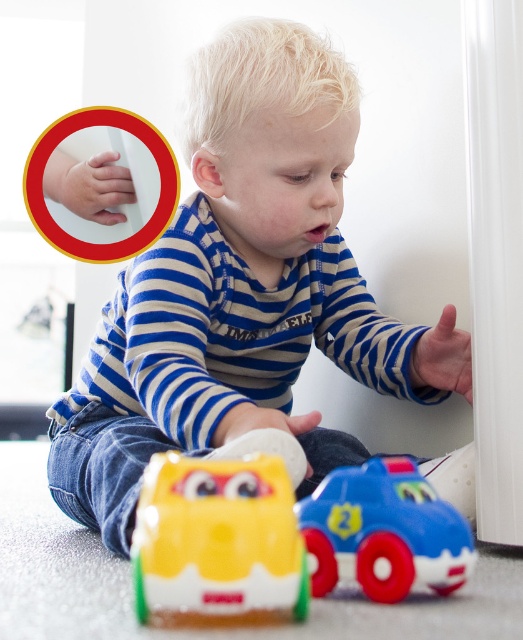
The child is trying to reach for the blue plastic toy car at lower center. Which direction should they move their matte plastic hand at upper left to get closer to the car?

The child should move their matte plastic hand at upper left to the right since it is currently to the left of the blue plastic toy car at lower center.

The child is trying to stack the two cars. Can the rubberized yellow car at lower center be placed on top of the blue plastic toy car at lower center?

Yes, the rubberized yellow car at lower center can be placed on top of the blue plastic toy car at lower center because it is located above it.